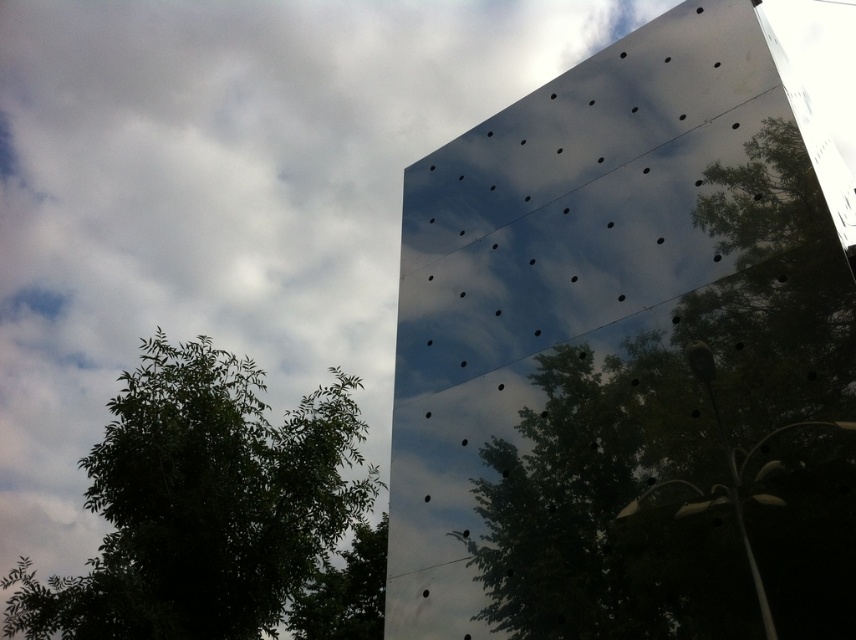
You are standing in front of the reflective glass panel and notice two green leafy trees in the reflection. Which tree, the green leafy tree at upper center or the green leafy tree at upper left, is positioned more to the right in the reflection?

The green leafy tree at upper center is positioned more to the right compared to the green leafy tree at upper left in the reflection.

You are a landscape architect planning to install a new bench between the green leafy tree at upper center and the green leafy tree at lower left. The bench requires at least 5 meters of space between the two trees to fit. Based on the scene, will the existing spacing accommodate the bench?

The distance between the green leafy tree at upper center and the green leafy tree at lower left is 6.12 meters, which is more than the required 5 meters. Therefore, the bench can be installed between them.